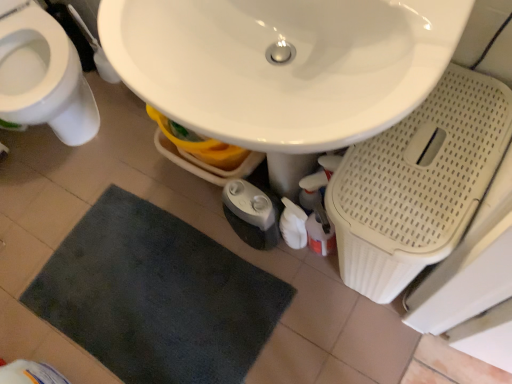
Question: Should I look upward or downward to see dark gray plush bath mat at lower center?

Choices:
 (A) up
 (B) down

Answer: (B)

Question: Would you say white glossy sink at center contains white glossy toilet at left?

Choices:
 (A) no
 (B) yes

Answer: (A)

Question: Can you confirm if white glossy sink at center is thinner than white glossy toilet at left?

Choices:
 (A) yes
 (B) no

Answer: (A)

Question: Is white glossy sink at center at the right side of white glossy toilet at left?

Choices:
 (A) no
 (B) yes

Answer: (B)

Question: Is white glossy sink at center oriented towards white glossy toilet at left?

Choices:
 (A) no
 (B) yes

Answer: (A)

Question: From a real-world perspective, is white glossy sink at center on top of white glossy toilet at left?

Choices:
 (A) yes
 (B) no

Answer: (A)

Question: From the image's perspective, is white glossy sink at center beneath white glossy toilet at left?

Choices:
 (A) yes
 (B) no

Answer: (A)

Question: Would you say dark gray plush bath mat at lower center contains white glossy toilet at left?

Choices:
 (A) no
 (B) yes

Answer: (A)

Question: From a real-world perspective, is dark gray plush bath mat at lower center located beneath white glossy toilet at left?

Choices:
 (A) yes
 (B) no

Answer: (A)

Question: From a real-world perspective, is dark gray plush bath mat at lower center positioned over white glossy toilet at left based on gravity?

Choices:
 (A) yes
 (B) no

Answer: (B)

Question: Can you confirm if dark gray plush bath mat at lower center is positioned to the left of white glossy toilet at left?

Choices:
 (A) no
 (B) yes

Answer: (A)

Question: From the image's perspective, is dark gray plush bath mat at lower center under white glossy toilet at left?

Choices:
 (A) yes
 (B) no

Answer: (A)

Question: Is dark gray plush bath mat at lower center positioned before white glossy toilet at left?

Choices:
 (A) no
 (B) yes

Answer: (A)

Question: Is dark gray plush bath mat at lower center taller than white glossy sink at center?

Choices:
 (A) yes
 (B) no

Answer: (B)